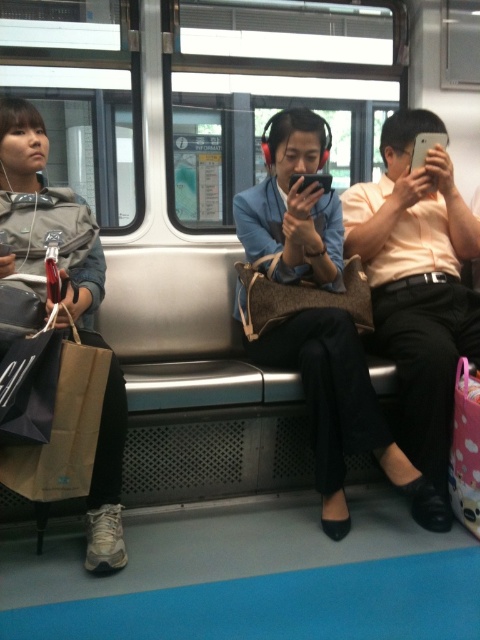
Question: Based on their relative distances, which object is nearer to the matte gray jacket at left?

Choices:
 (A) matte black pants at center
 (B) matte orange shirt at center

Answer: (A)

Question: Can you confirm if matte orange shirt at center is positioned below matte gray jacket at left?

Choices:
 (A) no
 (B) yes

Answer: (A)

Question: Considering the relative positions of matte black pants at center and matte gray jacket at left in the image provided, where is matte black pants at center located with respect to matte gray jacket at left?

Choices:
 (A) right
 (B) left

Answer: (A)

Question: Which of the following is the closest to the observer?

Choices:
 (A) matte orange shirt at center
 (B) matte gray jacket at left
 (C) matte black pants at center

Answer: (B)

Question: Is matte black pants at center bigger than matte gray jacket at left?

Choices:
 (A) yes
 (B) no

Answer: (A)

Question: Which of these objects is positioned closest to the matte orange shirt at center?

Choices:
 (A) matte black pants at center
 (B) matte gray jacket at left

Answer: (A)